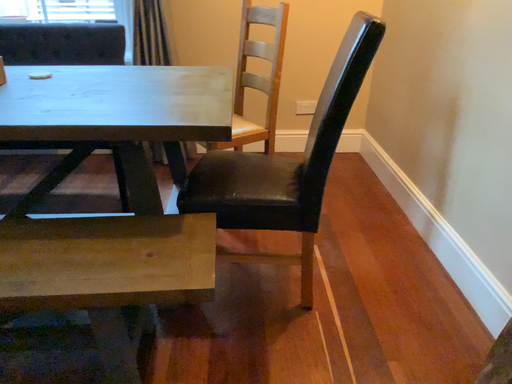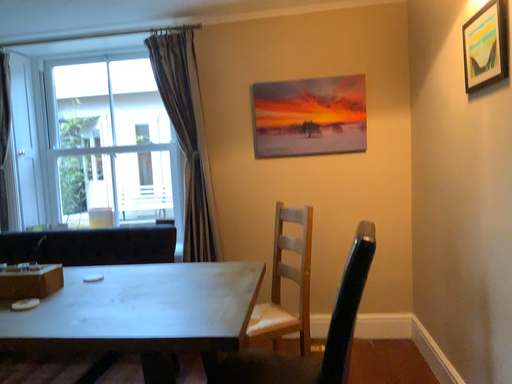
Question: Which way did the camera rotate in the video?

Choices:
 (A) rotated upward
 (B) rotated downward

Answer: (A)